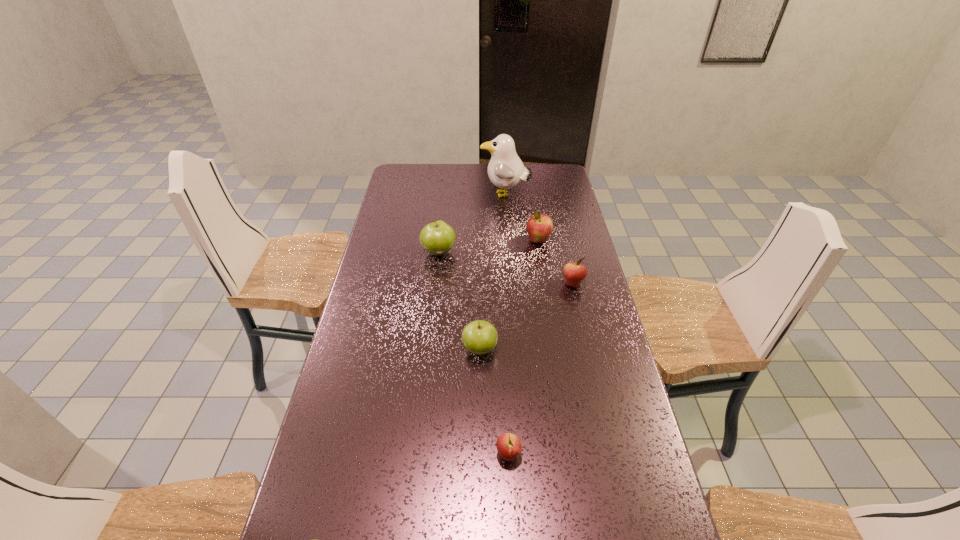
Locate an element on the screen. The width and height of the screenshot is (960, 540). object located at the far edge is located at coordinates (505, 170).

What are the coordinates of `vacant space at the far edge of the desktop` in the screenshot? It's located at (439, 178).

You are a GUI agent. You are given a task and a screenshot of the screen. Output one action in this format:
    pyautogui.click(x=<x>, y=<y>)
    Task: Click on the blank space at the left edge of the desktop
    The image size is (960, 540).
    Given the screenshot: What is the action you would take?
    pyautogui.click(x=420, y=200)

I want to click on vacant space at the right edge of the desktop, so click(562, 326).

At what (x,y) coordinates should I click in order to perform the action: click on free space at the far right corner. Please return your answer as a coordinate pair (x, y). This screenshot has width=960, height=540. Looking at the image, I should click on (562, 171).

This screenshot has width=960, height=540. What are the coordinates of `free space between the second nearest object and the second red apple from left to right` in the screenshot? It's located at (523, 348).

The height and width of the screenshot is (540, 960). I want to click on empty location between the third farthest apple and the biggest red apple, so click(x=556, y=262).

Where is `empty space between the second biggest green apple and the farthest red apple`? This screenshot has height=540, width=960. empty space between the second biggest green apple and the farthest red apple is located at coordinates (509, 295).

This screenshot has height=540, width=960. I want to click on free spot between the second nearest red apple and the second farthest green apple, so click(526, 316).

Identify the location of object that can be found as the fifth closest to the fifth apple from left to right. (509, 446).